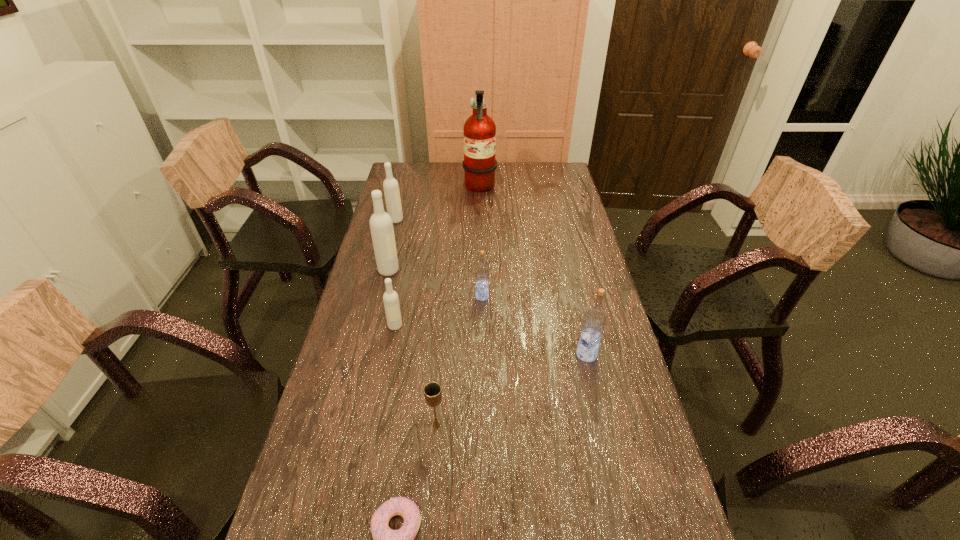
The image size is (960, 540). In order to click on the fifth nearest object in this screenshot , I will do (482, 272).

Where is `the smaller blue vodka`? Image resolution: width=960 pixels, height=540 pixels. the smaller blue vodka is located at coordinates (482, 272).

The image size is (960, 540). Identify the location of chalice. (432, 391).

You are a GUI agent. You are given a task and a screenshot of the screen. Output one action in this format:
    pyautogui.click(x=<x>, y=<y>)
    Task: Click on the seventh farthest object
    This screenshot has height=540, width=960.
    Given the screenshot: What is the action you would take?
    pyautogui.click(x=432, y=391)

The image size is (960, 540). Identify the location of vacant space located on the nozzle and handle of the farthest object. (522, 188).

Image resolution: width=960 pixels, height=540 pixels. In order to click on vacant space located 0.060m on the back of the biggest white vodka in this screenshot , I will do `click(393, 253)`.

The image size is (960, 540). Identify the location of vacant area situated on the front of the second farthest object. (387, 256).

Locate an element on the screen. The image size is (960, 540). blank area located on the front of the nearest vodka is located at coordinates (620, 501).

The width and height of the screenshot is (960, 540). What are the coordinates of `free space located on the left of the rightmost white vodka` in the screenshot? It's located at (344, 326).

The width and height of the screenshot is (960, 540). Find the location of `free region located 0.180m on the right of the third nearest vodka`. free region located 0.180m on the right of the third nearest vodka is located at coordinates (546, 297).